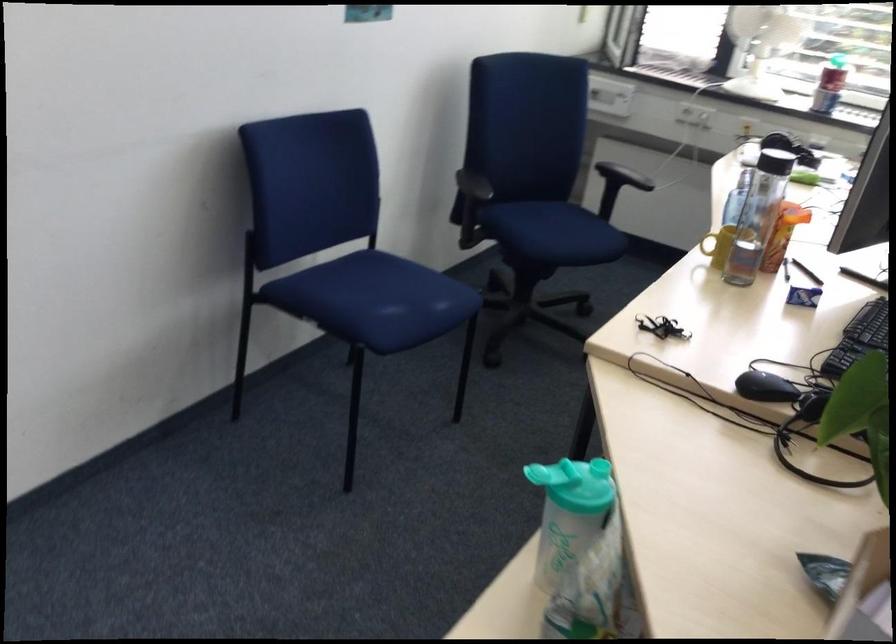
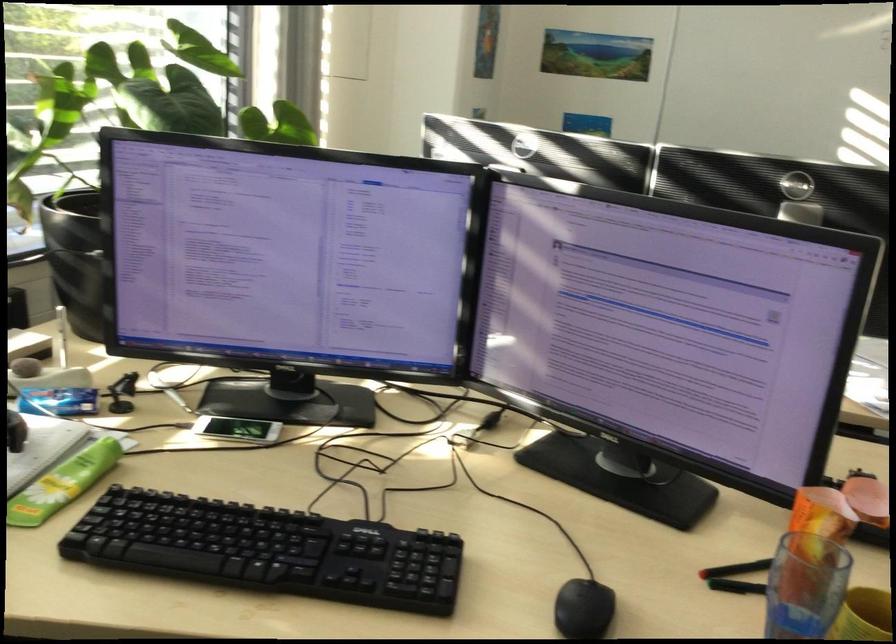
Locate, in the second image, the point that corresponds to point 800,164 in the first image.

(64, 483)